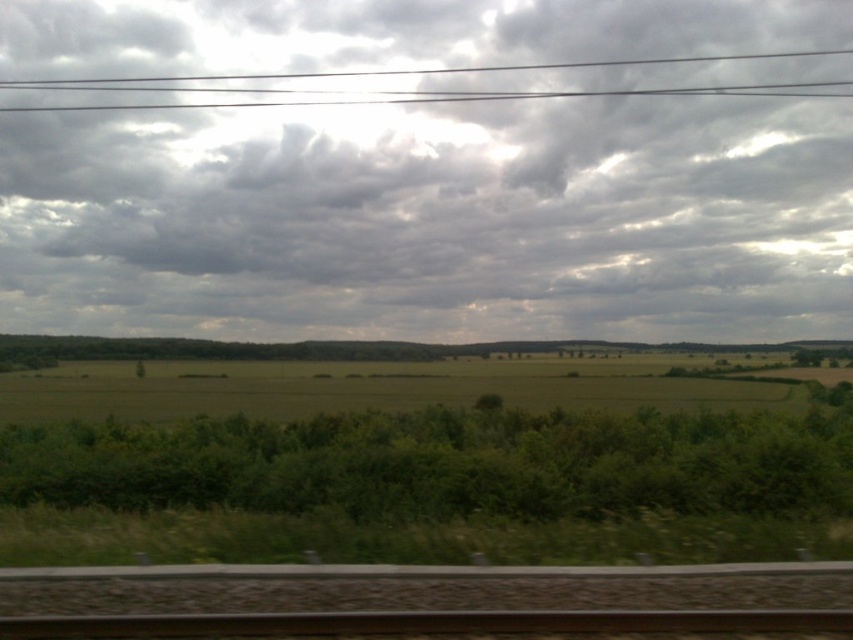
Can you confirm if cloudy sky at upper center is positioned above black wires at upper center?

Incorrect, cloudy sky at upper center is not positioned above black wires at upper center.

Between cloudy sky at upper center and black wires at upper center, which one appears on the left side from the viewer's perspective?

From the viewer's perspective, cloudy sky at upper center appears more on the left side.

Measure the distance between point (619, 45) and camera.

They are 528.26 feet apart.

Find the location of `cloudy sky at upper center`. cloudy sky at upper center is located at coordinates (432, 220).

Is cloudy sky at upper center in front of brown metallic train track at bottom?

No.

From the picture: Between cloudy sky at upper center and brown metallic train track at bottom, which one is positioned lower?

brown metallic train track at bottom is lower down.

Where is `cloudy sky at upper center`? Image resolution: width=853 pixels, height=640 pixels. cloudy sky at upper center is located at coordinates (432, 220).

Which is in front, point (723, 216) or point (494, 576)?

Point (494, 576) is in front.

Is cloudy sky at upper center further to the viewer compared to brown gravel train track at bottom?

A: Yes.

The image size is (853, 640). Describe the element at coordinates (432, 220) in the screenshot. I see `cloudy sky at upper center` at that location.

Identify the location of cloudy sky at upper center. (432, 220).